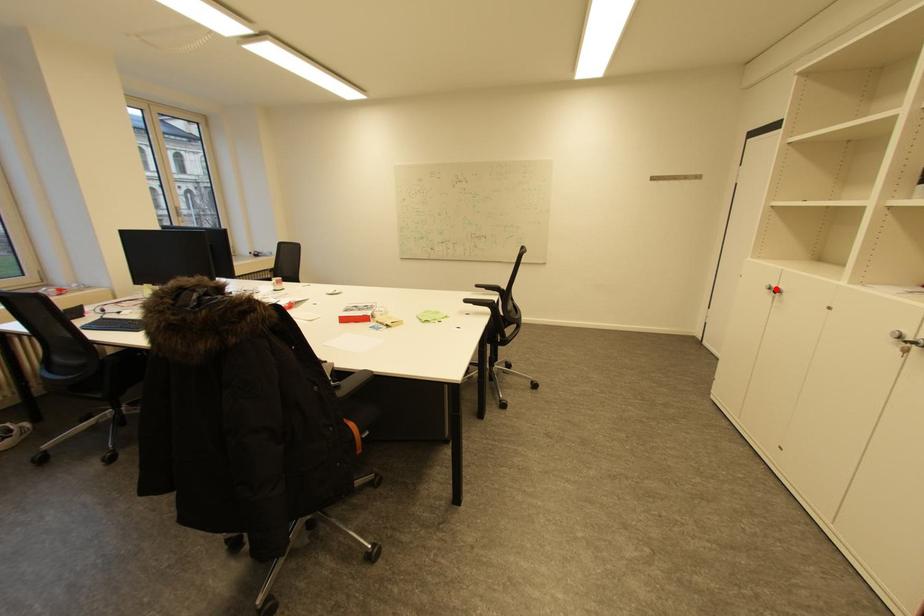
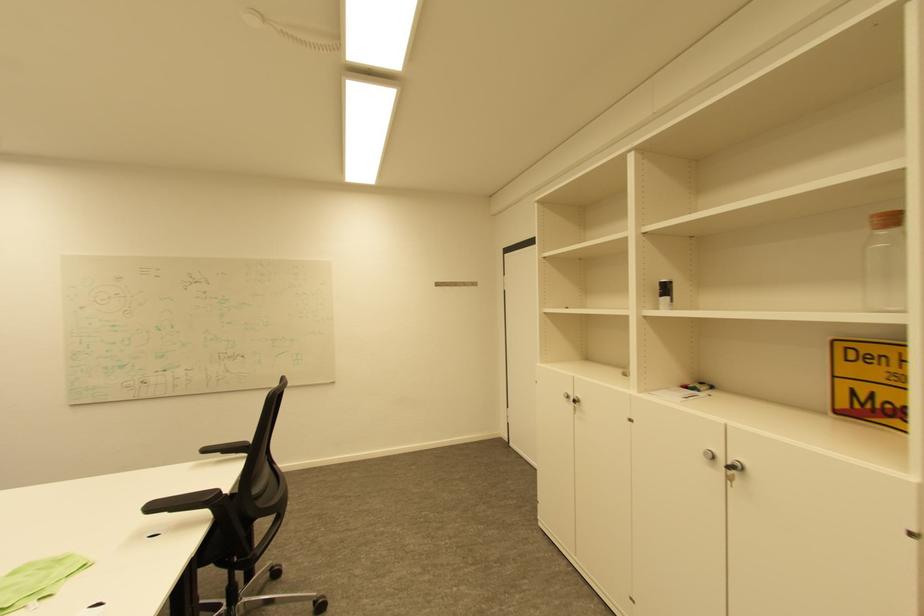
Where in the second image is the point corresponding to the highlighted location from the first image?

(574, 398)